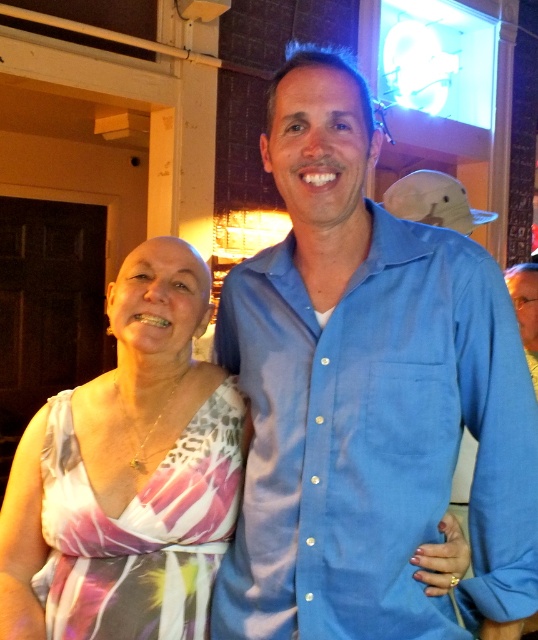
Can you confirm if blue cotton shirt at center is positioned to the right of printed fabric dress at center?

Yes, blue cotton shirt at center is to the right of printed fabric dress at center.

Between point (256, 552) and point (140, 451), which one is positioned behind?

The point (140, 451) is behind.

You are a GUI agent. You are given a task and a screenshot of the screen. Output one action in this format:
    pyautogui.click(x=<x>, y=<y>)
    Task: Click on the blue cotton shirt at center
    The image size is (538, 640).
    Given the screenshot: What is the action you would take?
    pyautogui.click(x=377, y=442)